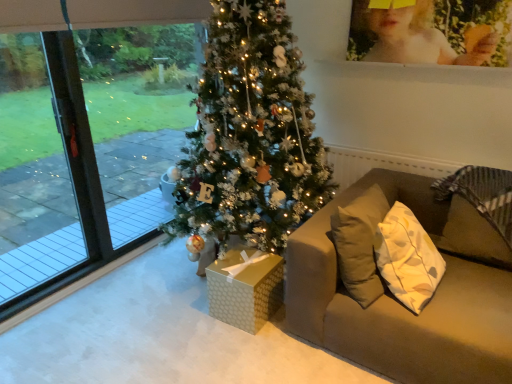
Locate an element on the screen. free space above gold textured gift box at center (from a real-world perspective) is located at coordinates (250, 262).